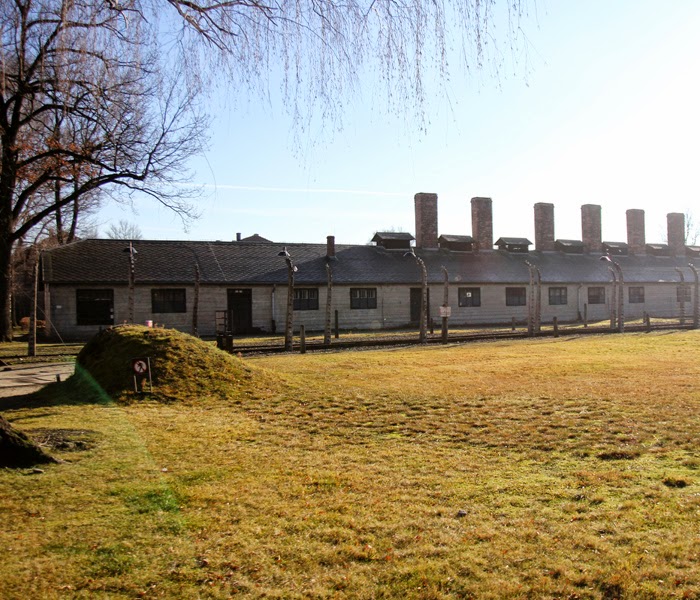
Find the location of `chimney`. chimney is located at coordinates (430, 218), (483, 220), (547, 225), (593, 227), (636, 234), (672, 237).